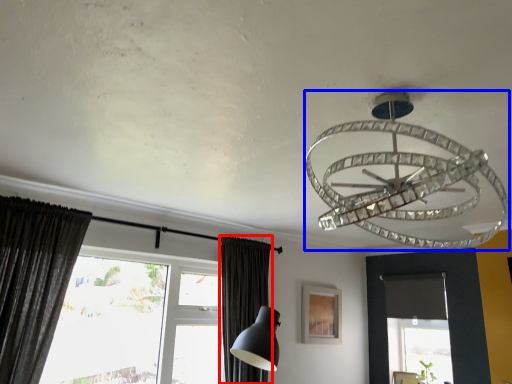
Question: Among these objects, which one is nearest to the camera, curtain (highlighted by a red box) or lamp (highlighted by a blue box)?

Choices:
 (A) curtain
 (B) lamp

Answer: (B)